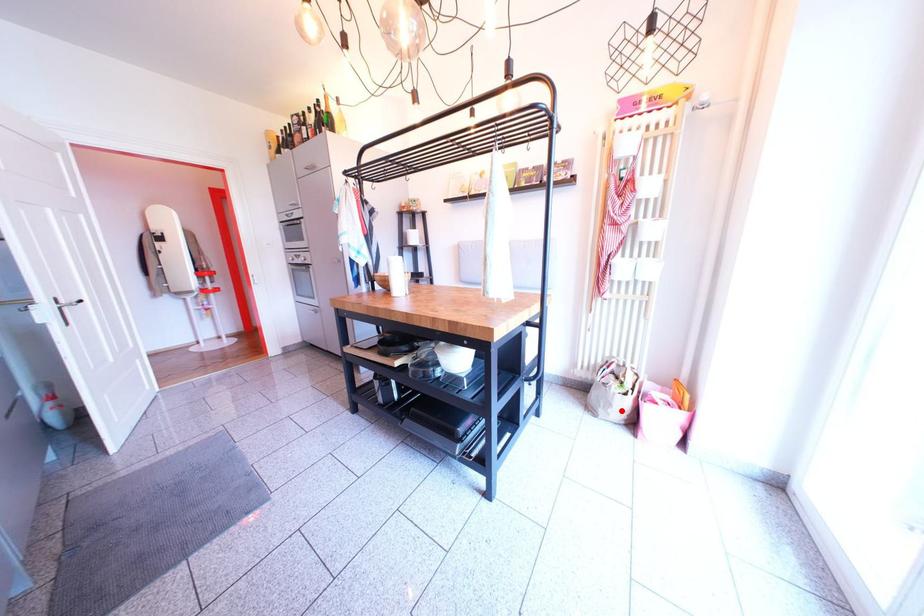
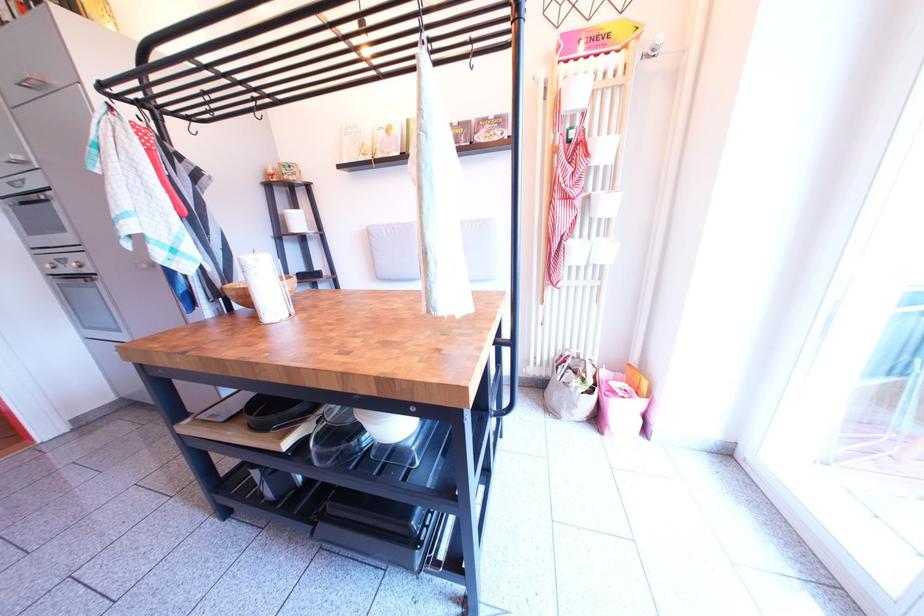
The point at the highlighted location is marked in the first image. Where is the corresponding point in the second image?

(586, 411)